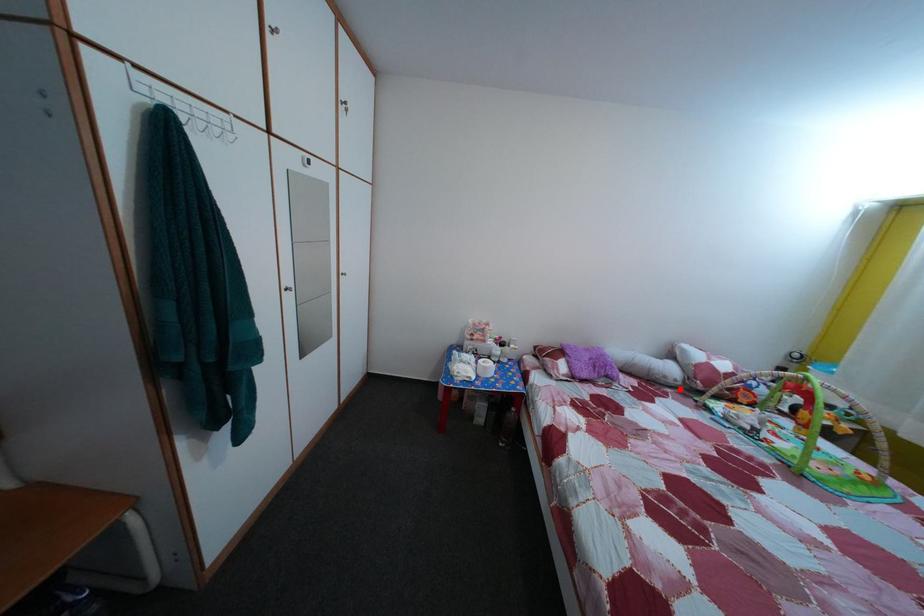
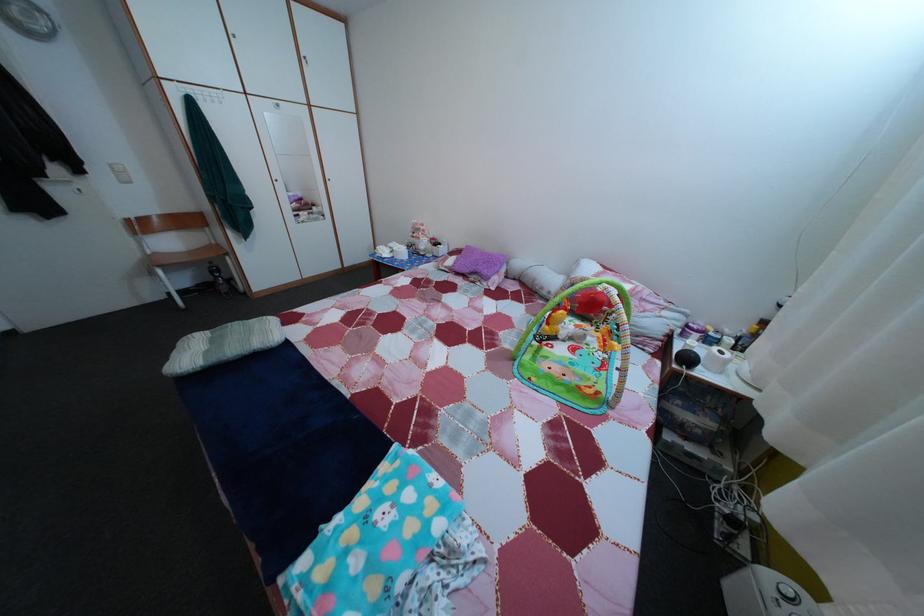
Question: I am providing you with two images of the same scene from different viewpoints. Given a red point in image1, look at the same physical point in image2. Is it:

Choices:
 (A) Closer to the viewpoint
 (B) Farther from the viewpoint

Answer: (A)